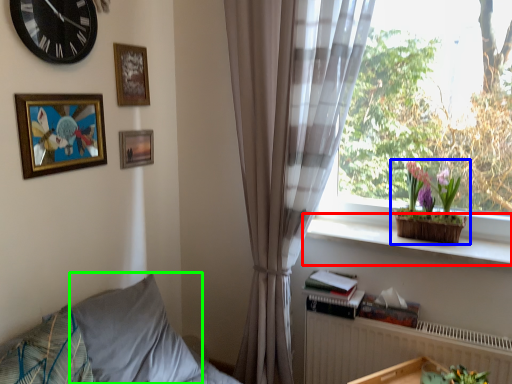
Question: Which object is the farthest from window sill (highlighted by a red box)? Choose among these: houseplant (highlighted by a blue box) or pillow (highlighted by a green box).

Choices:
 (A) houseplant
 (B) pillow

Answer: (B)